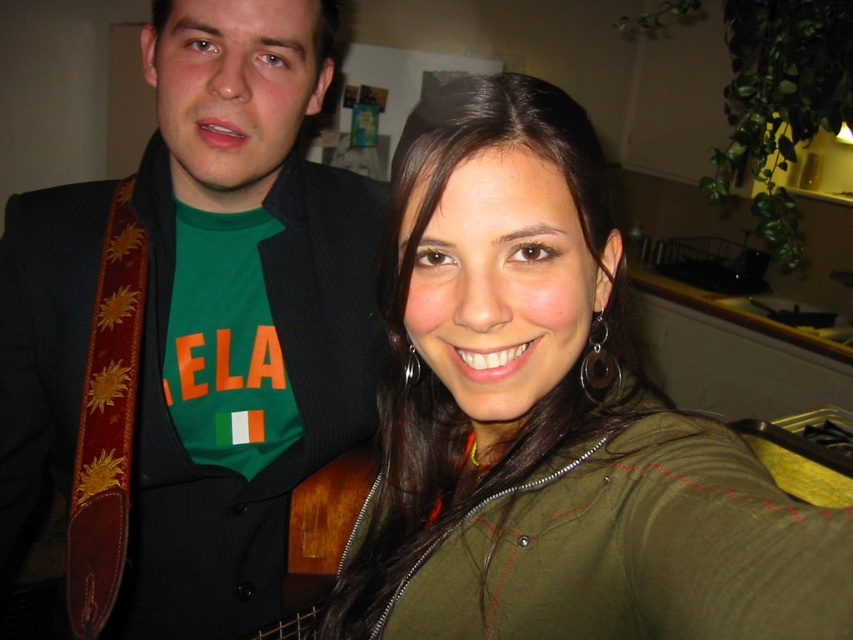
You are standing in the room and want to reach both points. Which point, point (x=383, y=193) or point (x=519, y=83), will you reach first?

Point (x=383, y=193) is closer to you, so you will reach it first.

You are an interior designer working on a project and need to place a 0.6m by 0.6m decorative item on the floor. The green fabric jacket at center is located at point 0.664, 0.651. If the room is a square with sides of 1 meter, can you place the item at point 0.5, 0.5 without overlapping the jacket?

The green fabric jacket at center is located at point [554,424]. The distance between point [426,320] and the jacket is sqrt of 0.164 squared plus 0.151 squared which is approximately 0.222 meters. Since the decorative item is 0.6m by 0.6m, the closest edge would be 0.5m plus half of 0.6m which is 0.8m, but this calculation might be incorrect. The jacket is at 0.664, so subtract half of 0.6 gives 0.664 minus 0.3 equals 0.364. Wait, perhaps better to see if the jacket is within 0.3 meters from the center.